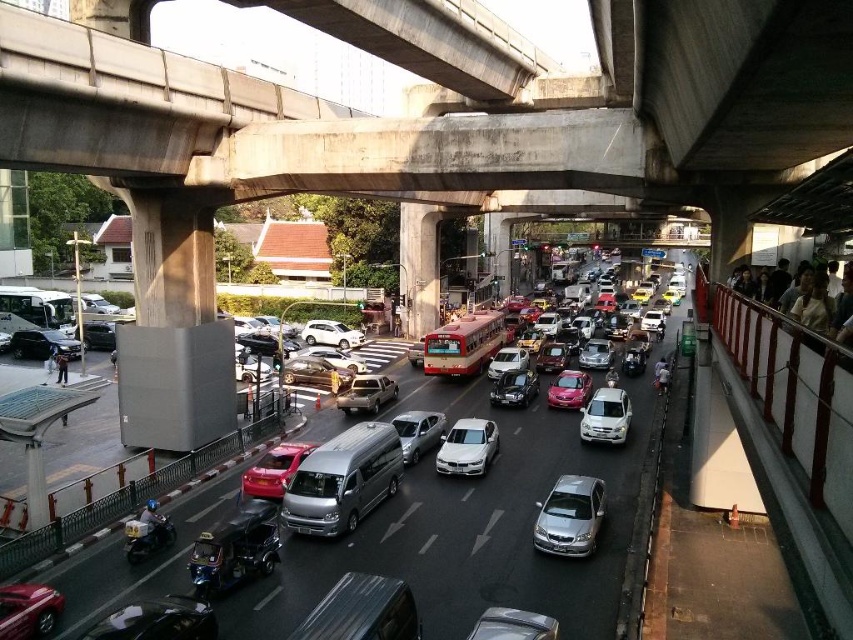
Question: Observing the image, what is the correct spatial positioning of satin silver sedan at center in reference to metallic pink car at center?

Choices:
 (A) right
 (B) left

Answer: (B)

Question: Is silver metallic van at center above shiny silver car at center?

Choices:
 (A) no
 (B) yes

Answer: (B)

Question: Which point appears closest to the camera in this image?

Choices:
 (A) (614, 397)
 (B) (438, 442)
 (C) (451, 458)

Answer: (C)

Question: Which point is farther to the camera?

Choices:
 (A) (500, 384)
 (B) (314, 100)

Answer: (A)

Question: Is matte red bus at center wider than shiny black sedan at center?

Choices:
 (A) yes
 (B) no

Answer: (A)

Question: Which object is the closest to the metallic silver pickup truck at center?

Choices:
 (A) white matte car at center
 (B) shiny red car at lower left
 (C) white metallic sedan at center

Answer: (C)